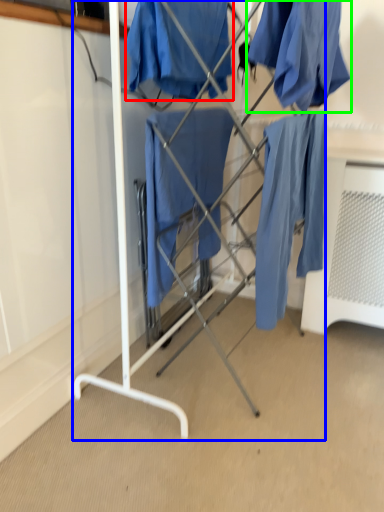
Question: Considering the real-world distances, which object is closest to clothing (highlighted by a red box)? furniture (highlighted by a blue box) or clothing (highlighted by a green box).

Choices:
 (A) furniture
 (B) clothing

Answer: (B)